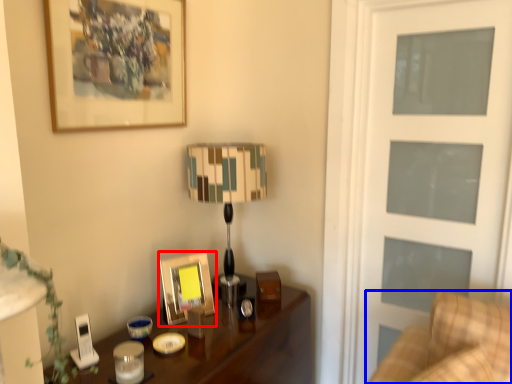
Question: Which object appears farthest to the camera in this image, picture frame (highlighted by a red box) or furniture (highlighted by a blue box)?

Choices:
 (A) picture frame
 (B) furniture

Answer: (A)